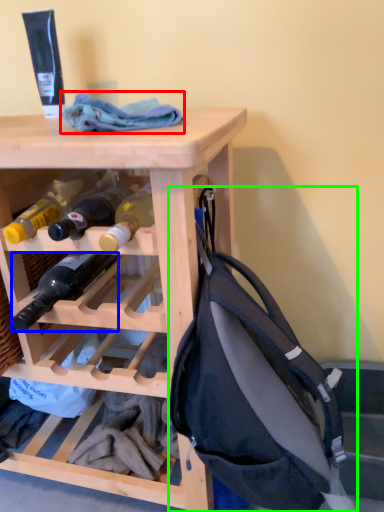
Question: Estimate the real-world distances between objects in this image. Which object is farther from cloth (highlighted by a red box), bottle (highlighted by a blue box) or backpack (highlighted by a green box)?

Choices:
 (A) bottle
 (B) backpack

Answer: (B)